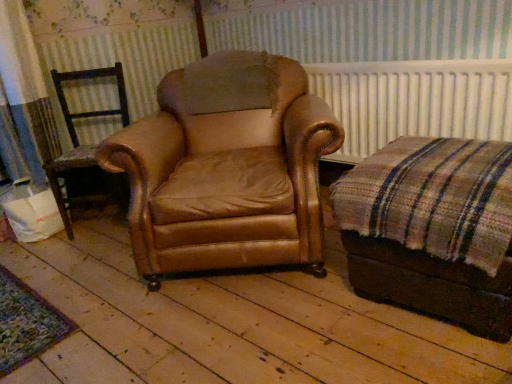
Question: Is plaid fabric ottoman at right shorter than brown leather chair at left, which appears as the 1th chair when viewed from the left?

Choices:
 (A) yes
 (B) no

Answer: (A)

Question: Can you confirm if plaid fabric ottoman at right is thinner than brown leather chair at left, which appears as the 1th chair when viewed from the left?

Choices:
 (A) no
 (B) yes

Answer: (A)

Question: Does plaid fabric ottoman at right have a larger size compared to brown leather chair at left, which is counted as the 2th chair, starting from the right?

Choices:
 (A) no
 (B) yes

Answer: (B)

Question: Does plaid fabric ottoman at right have a greater width compared to brown leather chair at left, which is counted as the 2th chair, starting from the right?

Choices:
 (A) yes
 (B) no

Answer: (A)

Question: Does plaid fabric ottoman at right appear on the right side of brown leather chair at left, which is counted as the 2th chair, starting from the right?

Choices:
 (A) yes
 (B) no

Answer: (A)

Question: Looking at their shapes, would you say plaid fabric ottoman at right is wider or thinner than brown leather chair at left, which appears as the 1th chair when viewed from the left?

Choices:
 (A) wide
 (B) thin

Answer: (A)

Question: Is point (371, 200) closer or farther from the camera than point (108, 71)?

Choices:
 (A) closer
 (B) farther

Answer: (A)

Question: From the image's perspective, relative to brown leather chair at left, which appears as the 1th chair when viewed from the left, is plaid fabric ottoman at right above or below?

Choices:
 (A) above
 (B) below

Answer: (B)

Question: Is plaid fabric ottoman at right spatially inside brown leather chair at left, which is counted as the 2th chair, starting from the right, or outside of it?

Choices:
 (A) inside
 (B) outside

Answer: (B)

Question: Considering the positions of white radiator at upper center and leather armchair at center, placed as the 2th chair when sorted from left to right, in the image, is white radiator at upper center wider or thinner than leather armchair at center, placed as the 2th chair when sorted from left to right,?

Choices:
 (A) wide
 (B) thin

Answer: (B)

Question: Is white radiator at upper center spatially inside leather armchair at center, which is counted as the first chair, starting from the right, or outside of it?

Choices:
 (A) inside
 (B) outside

Answer: (B)

Question: In the image, is white radiator at upper center positioned in front of or behind leather armchair at center, placed as the 2th chair when sorted from left to right?

Choices:
 (A) behind
 (B) front

Answer: (A)

Question: Is point (401, 130) closer or farther from the camera than point (216, 66)?

Choices:
 (A) closer
 (B) farther

Answer: (A)

Question: Looking at their shapes, would you say brown leather chair at left, which is counted as the 2th chair, starting from the right, is wider or thinner than leather armchair at center, placed as the 2th chair when sorted from left to right?

Choices:
 (A) thin
 (B) wide

Answer: (A)

Question: Based on their sizes in the image, would you say brown leather chair at left, which is counted as the 2th chair, starting from the right, is bigger or smaller than leather armchair at center, placed as the 2th chair when sorted from left to right?

Choices:
 (A) small
 (B) big

Answer: (A)